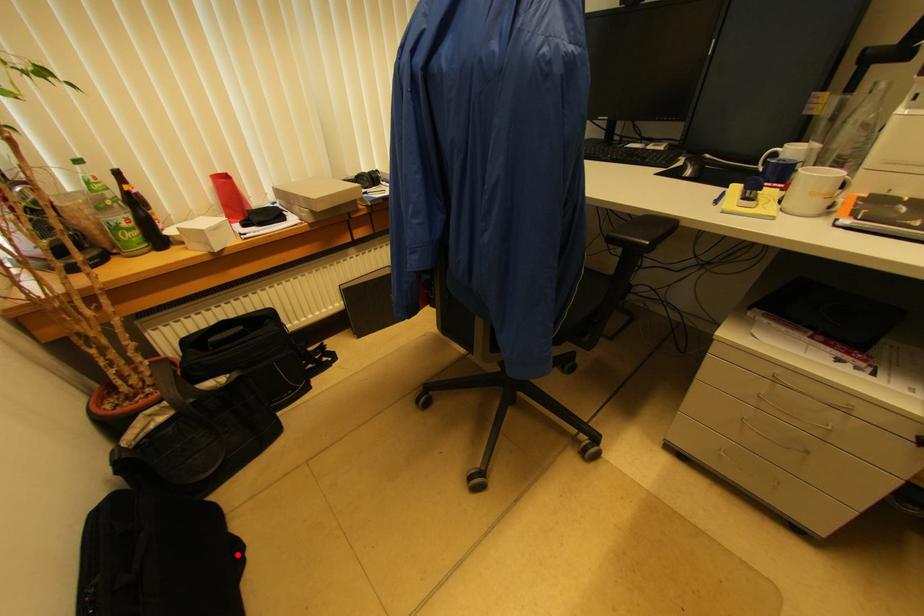
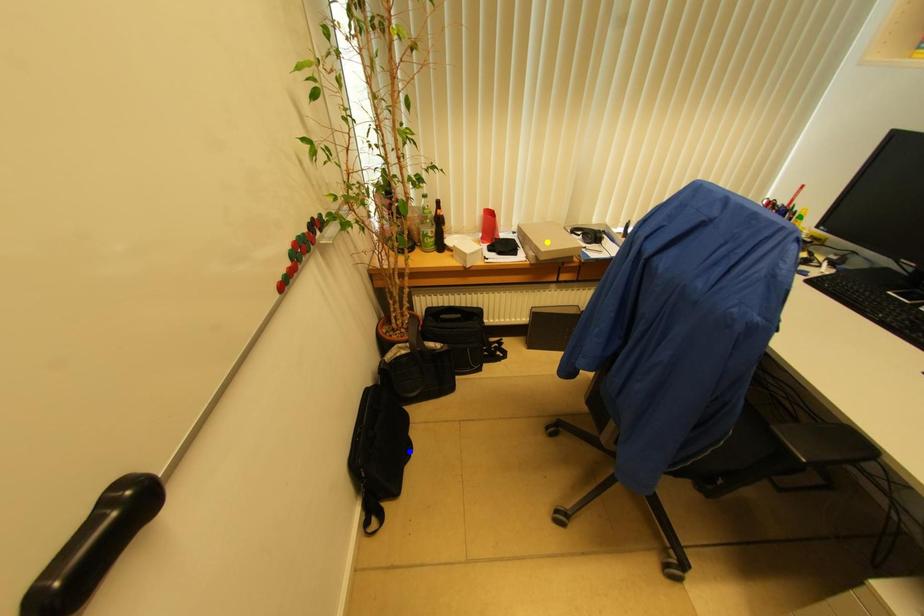
Question: I am providing you with two images of the same scene from different viewpoints. A red point is marked on the first image. You are given multiple points on the second image. Which point in image 2 represents the same 3d spot as the red point in image 1?

Choices:
 (A) blue point
 (B) yellow point
 (C) green point

Answer: (A)